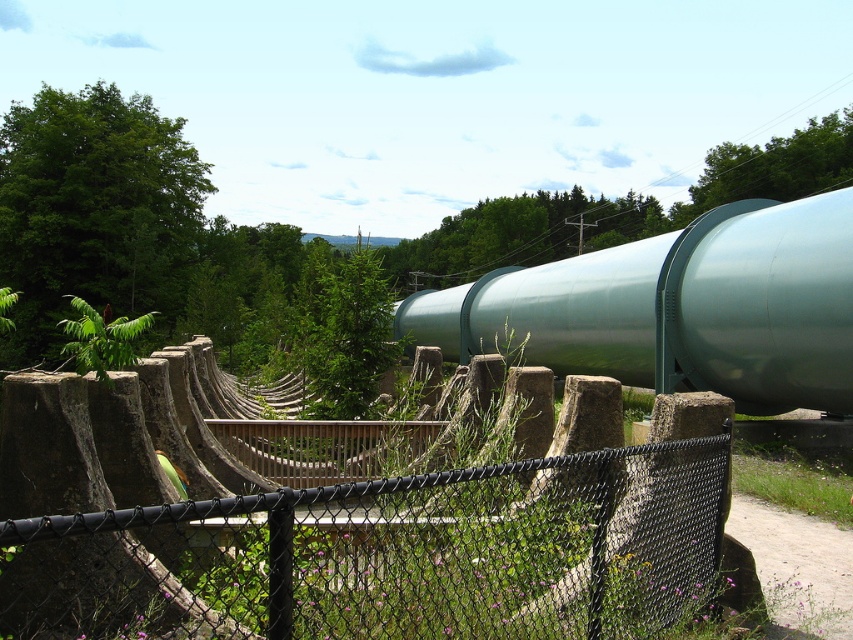
Is point (821, 378) less distant than point (631, 218)?

Yes.

Consider the image. Is green metallic pipe at center below green leafy tree at center?

Indeed, green metallic pipe at center is positioned under green leafy tree at center.

Does point (677, 360) lie behind point (573, 205)?

No, it is not.

Locate an element on the screen. Image resolution: width=853 pixels, height=640 pixels. green metallic pipe at center is located at coordinates (677, 307).

Which of these two, green metallic pipe at center or green leafy tree at upper right, stands shorter?

With less height is green metallic pipe at center.

Is green metallic pipe at center to the left of green leafy tree at upper right from the viewer's perspective?

Correct, you'll find green metallic pipe at center to the left of green leafy tree at upper right.

Where is `green metallic pipe at center`? The height and width of the screenshot is (640, 853). green metallic pipe at center is located at coordinates (677, 307).

Is black chain-link fence at center taller than green leafy tree at upper right?

No.

Does black chain-link fence at center have a lesser height compared to green leafy tree at upper right?

Correct, black chain-link fence at center is not as tall as green leafy tree at upper right.

I want to click on black chain-link fence at center, so click(399, 554).